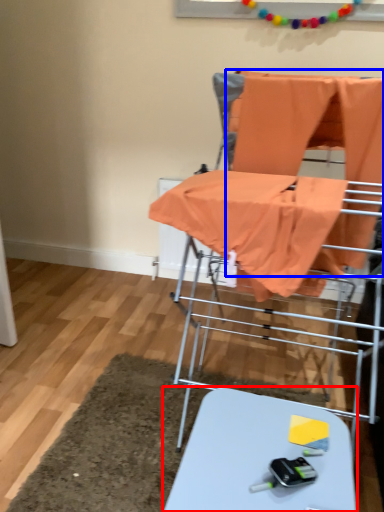
Question: Which point is further to the camera, table (highlighted by a red box) or fabric (highlighted by a blue box)?

Choices:
 (A) table
 (B) fabric

Answer: (B)